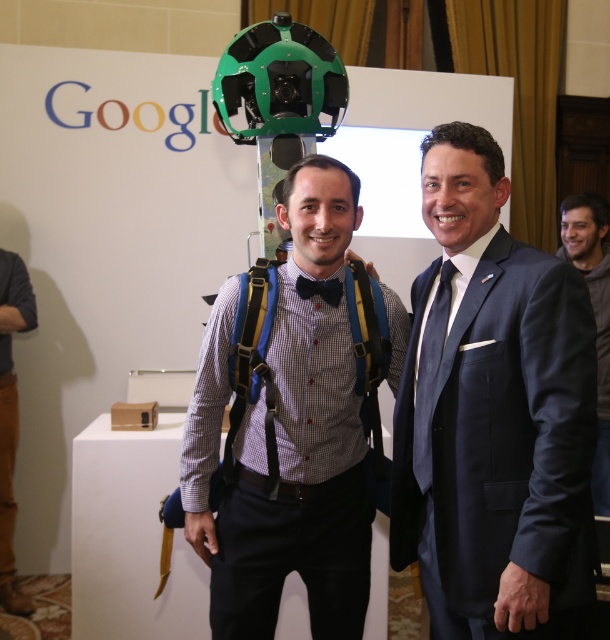
Question: Which of the following is the closest to the observer?

Choices:
 (A) (265, 371)
 (B) (295, 374)

Answer: (A)

Question: Can you confirm if navy blue suit at center is wider than black satin bow tie at center?

Choices:
 (A) yes
 (B) no

Answer: (A)

Question: Which of these objects is positioned farthest from the blue fabric suspenders at center?

Choices:
 (A) navy blue suit at center
 (B) dark gray textured jacket at center
 (C) brown leather pants at lower left

Answer: (C)

Question: Is navy blue suit at center closer to camera compared to black satin bow tie at center?

Choices:
 (A) no
 (B) yes

Answer: (B)

Question: Which object is farther from the camera taking this photo?

Choices:
 (A) navy blue suit at center
 (B) dark gray textured jacket at center
 (C) brown leather pants at lower left

Answer: (C)

Question: Does brown leather pants at lower left appear over black satin bow tie at center?

Choices:
 (A) yes
 (B) no

Answer: (B)